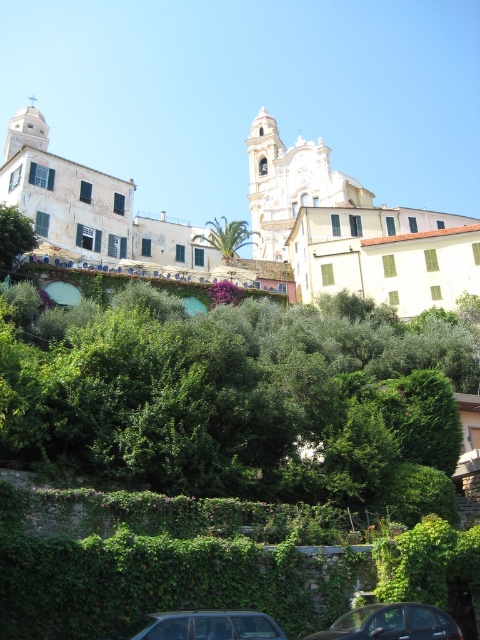
Question: Which point is farther to the camera?

Choices:
 (A) (0, 246)
 (B) (375, 614)
 (C) (260, 612)
 (D) (205, 224)

Answer: (D)

Question: Can you confirm if white stone church at upper center is positioned to the right of metallic silver car at lower center?

Choices:
 (A) yes
 (B) no

Answer: (B)

Question: Can you confirm if white stone church at upper center is thinner than green leafy palm at center?

Choices:
 (A) yes
 (B) no

Answer: (B)

Question: Is white stone church at upper center smaller than metallic silver car at lower center?

Choices:
 (A) no
 (B) yes

Answer: (A)

Question: Which object appears closest to the camera in this image?

Choices:
 (A) green leafy palm at center
 (B) white stone church at upper center
 (C) white smooth church at center

Answer: (B)

Question: Which point is closer to the camera?

Choices:
 (A) (182, 324)
 (B) (421, 227)

Answer: (A)